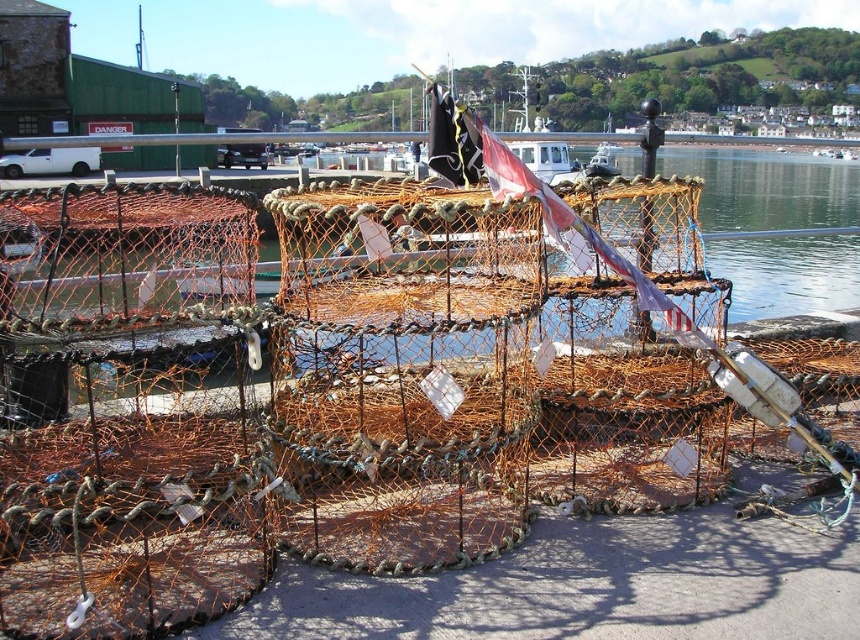
In the scene shown: You are standing at the edge of the harbor and want to place a new crab pot in the water. The existing rustic wire mesh crab pot at center is already at point 0.584, 0.469. If you want to place your new crab pot 1 meter to the north of the existing one, where should you place it?

You should place your new crab pot at the coordinates north of the rustic wire mesh crab pot at center, specifically at point (402, 372) plus 1 meter north. However, without knowing the coordinate system scale, it is impossible to determine the exact numerical coordinates.

You are a dock worker who needs to move the rustic wire mesh crab pot at center and the orange mesh netting at center to a storage area. Since you can only carry one item at a time, which item should you move first if you want to start with the one closer to the left side of the dock?

The rustic wire mesh crab pot at center is to the left of orange mesh netting at center, so you should move the rustic wire mesh crab pot at center first since it is closer to the left side of the dock.